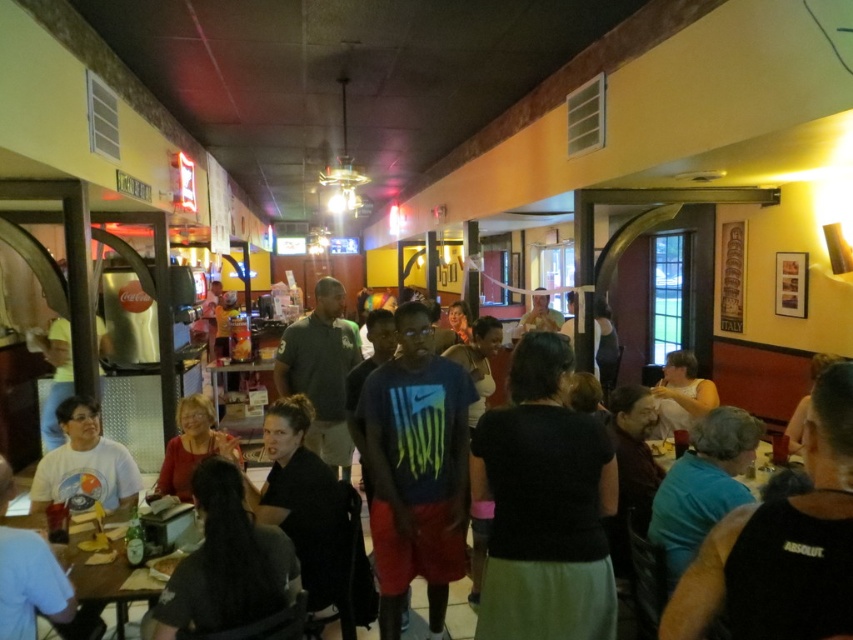
Question: Among these objects, which one is farthest from the camera?

Choices:
 (A) black matte shirt at center
 (B) wooden table at center

Answer: (B)

Question: Is blue fabric shirt at lower right wider than wooden table at center?

Choices:
 (A) no
 (B) yes

Answer: (A)

Question: Which object is closer to the camera taking this photo?

Choices:
 (A) white t-shirt at lower left
 (B) wooden table at lower left

Answer: (B)

Question: Can you confirm if blue fabric shirt at lower right is positioned above white t-shirt at lower left?

Choices:
 (A) no
 (B) yes

Answer: (A)

Question: Is dark gray shirt at lower left to the right of wooden table at lower left from the viewer's perspective?

Choices:
 (A) no
 (B) yes

Answer: (B)

Question: Based on their relative distances, which object is farther from the dark gray shirt at lower left?

Choices:
 (A) black matte shirt at center
 (B) matte red shirt at center

Answer: (B)